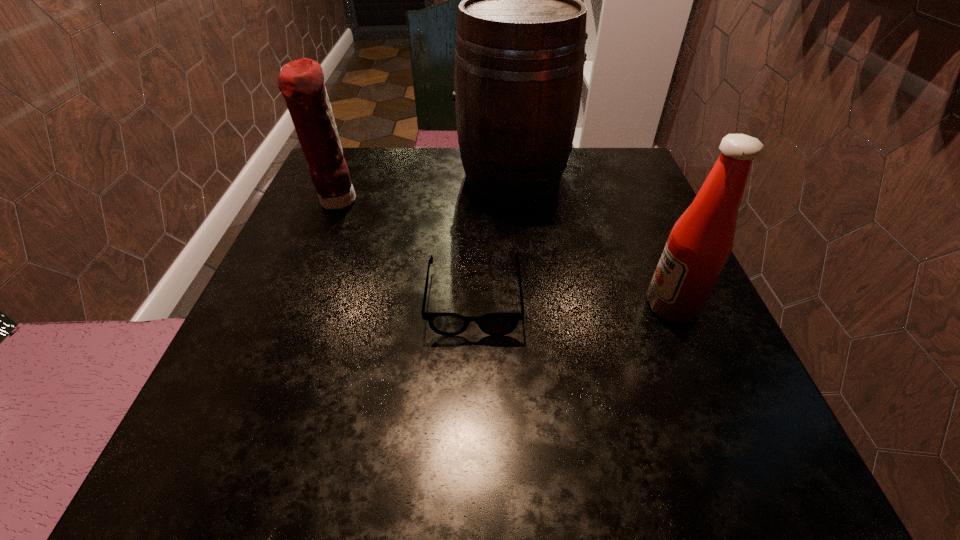
I want to click on vacant region at the right edge of the desktop, so click(x=596, y=219).

At what (x,y) coordinates should I click in order to perform the action: click on free spot at the near left corner of the desktop. Please return your answer as a coordinate pair (x, y). Image resolution: width=960 pixels, height=540 pixels. Looking at the image, I should click on (294, 463).

Find the location of a particular element. The height and width of the screenshot is (540, 960). vacant space at the far right corner is located at coordinates (616, 173).

In the image, there is a desktop. Where is `vacant space at the near right corner`? vacant space at the near right corner is located at coordinates (750, 446).

The width and height of the screenshot is (960, 540). I want to click on free point between the cider and the leftmost object, so click(x=424, y=188).

Find the location of `empty space that is in between the cider and the spectacles`. empty space that is in between the cider and the spectacles is located at coordinates pos(493,237).

Where is `empty space between the spectacles and the right condiment`? empty space between the spectacles and the right condiment is located at coordinates 573,302.

At what (x,y) coordinates should I click in order to perform the action: click on free space between the cider and the shortest object. Please return your answer as a coordinate pair (x, y). The width and height of the screenshot is (960, 540). Looking at the image, I should click on (493, 237).

At what (x,y) coordinates should I click in order to perform the action: click on empty location between the tallest object and the nearer condiment. Please return your answer as a coordinate pair (x, y). Looking at the image, I should click on (592, 241).

Image resolution: width=960 pixels, height=540 pixels. I want to click on free point between the left condiment and the cider, so (424, 188).